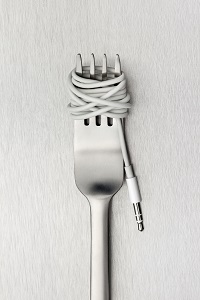
Where is `cable`? This screenshot has width=200, height=300. cable is located at coordinates (102, 94), (121, 152).